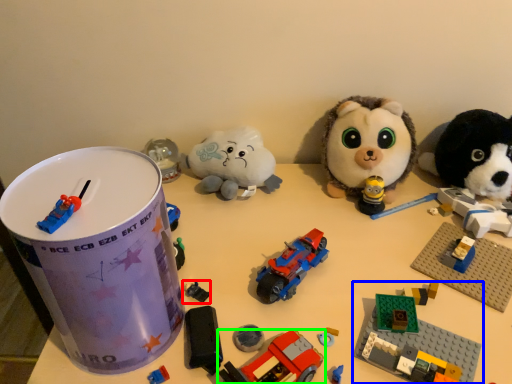
Question: Which is nearer to the toy (highlighted by a red box)? toy (highlighted by a blue box) or toy (highlighted by a green box).

Choices:
 (A) toy
 (B) toy

Answer: (B)